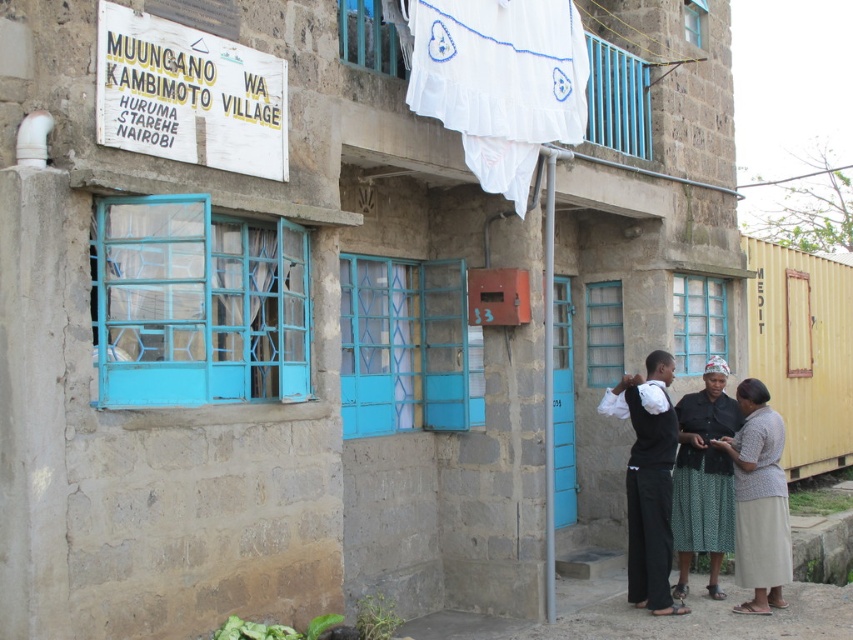
You are a visitor standing in front of the building. You see the white fabric at upper center and the dark green textured skirt at center. Which object is closer to you?

The white fabric at upper center is closer to you because it is in front of the dark green textured skirt at center.

Based on the photo, you are a tailor who needs to determine which item between the white fabric at upper center and the white textured skirt at lower right has a larger width to decide which one can be used for a project requiring a wider material. Based on the scene, can you tell which one is wider?

The white fabric at upper center is wider than the white textured skirt at lower right according to the description.

You are a fashion designer observing two skirts displayed in a shop window of the Muungano Kambimoto building. The skirts are the dark green textured skirt at center and the white textured skirt at lower right. Which skirt is taller?

The dark green textured skirt at center is taller than the white textured skirt at lower right.